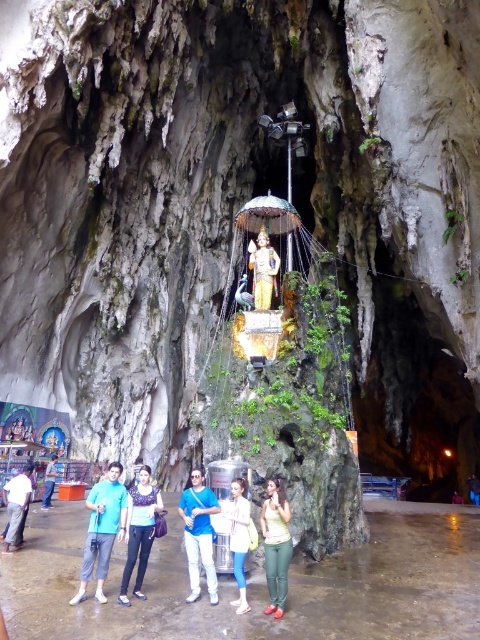
Question: Among these objects, which one is farthest from the camera?

Choices:
 (A) white matte jacket at center
 (B) green fabric pants at center
 (C) blue cotton shirt at center

Answer: (A)

Question: Can you confirm if denim jeans at center is positioned below light blue shirt at center?

Choices:
 (A) no
 (B) yes

Answer: (A)

Question: Among these points, which one is nearest to the camera?

Choices:
 (A) (272, 534)
 (B) (239, 566)
 (C) (208, 540)
 (D) (124, 586)

Answer: (D)

Question: Is blue fabric shirt at center positioned before white matte jacket at center?

Choices:
 (A) no
 (B) yes

Answer: (A)

Question: Estimate the real-world distances between objects in this image. Which object is farther from the green fabric pants at center?

Choices:
 (A) gold statue at center
 (B) light blue shirt at center
 (C) blue fabric shirt at center
 (D) white cotton shirt at lower left

Answer: (B)

Question: Is blue cotton shirt at center above light blue shirt at center?

Choices:
 (A) yes
 (B) no

Answer: (A)